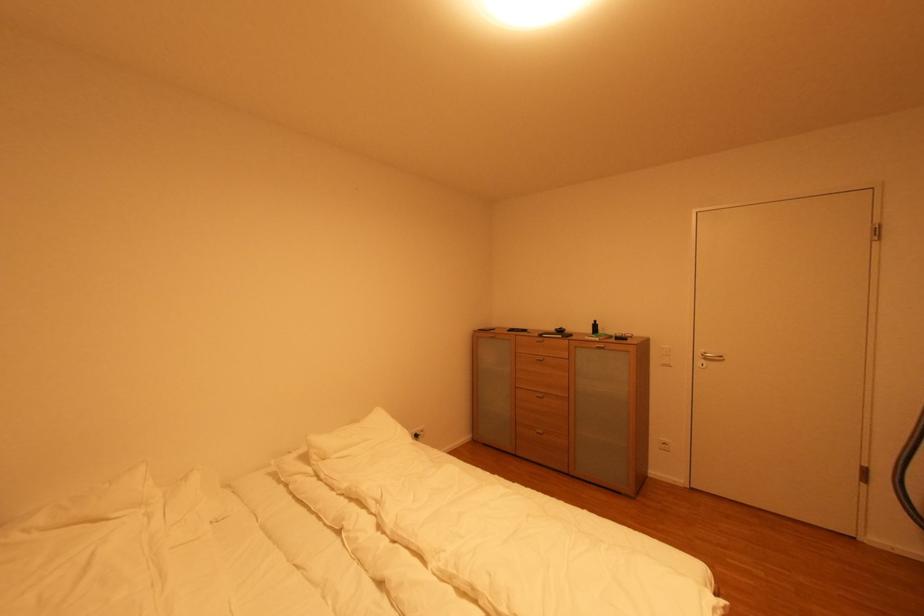
What are the coordinates of `white light switch` in the screenshot? It's located at (664, 355).